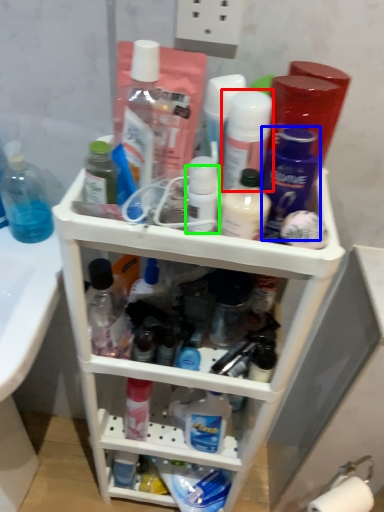
Question: Based on their relative distances, which object is farther from toiletry (highlighted by a red box)? Choose from toiletry (highlighted by a blue box) and toiletry (highlighted by a green box).

Choices:
 (A) toiletry
 (B) toiletry

Answer: (B)